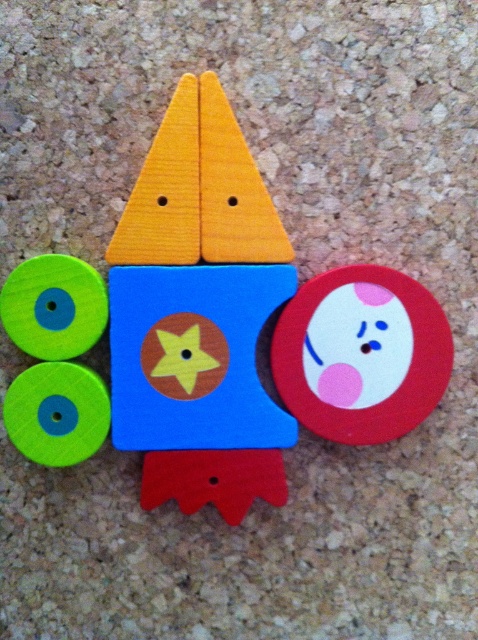
Question: Which of the following is the farthest from the observer?

Choices:
 (A) (386, 284)
 (B) (402, 320)

Answer: (A)

Question: Can you confirm if wooden rocket at center is smaller than matte red circle at center?

Choices:
 (A) no
 (B) yes

Answer: (A)

Question: Is wooden rocket at center to the right of matte red circle at center from the viewer's perspective?

Choices:
 (A) no
 (B) yes

Answer: (A)

Question: Can you confirm if wooden rocket at center is smaller than matte red circle at center?

Choices:
 (A) yes
 (B) no

Answer: (B)